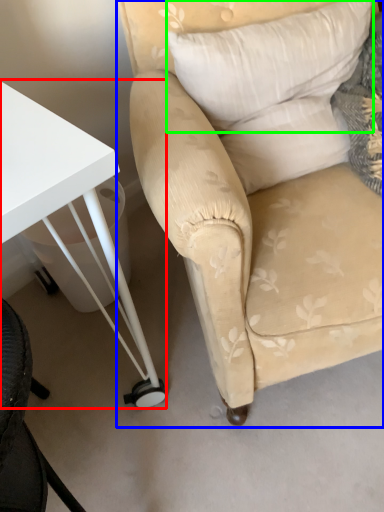
Question: Which object is positioned farthest from table (highlighted by a red box)? Select from chair (highlighted by a blue box) and pillow (highlighted by a green box).

Choices:
 (A) chair
 (B) pillow

Answer: (B)